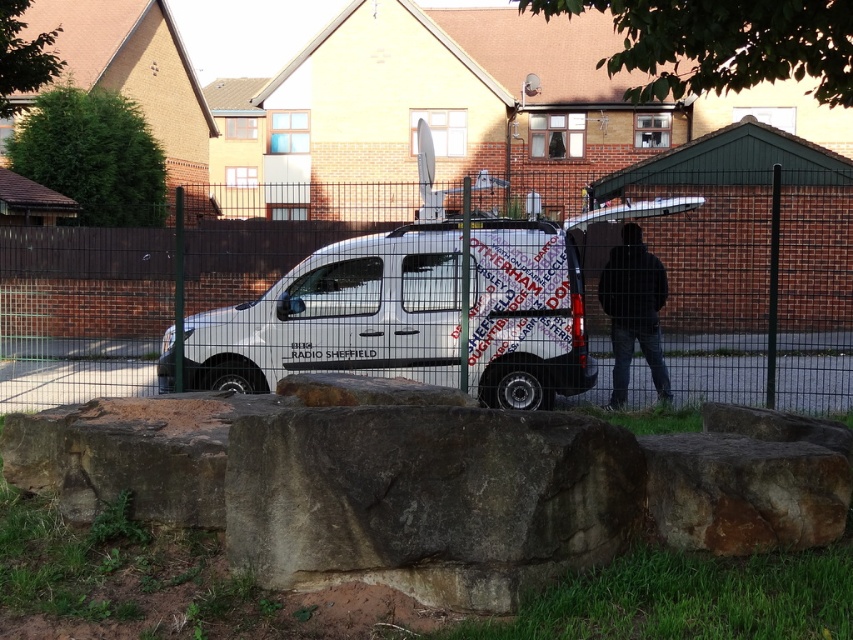
Is brown rough stone at center wider than white metallic van at center?

No.

From the picture: How distant is brown rough stone at center from white metallic van at center?

brown rough stone at center is 4.81 meters from white metallic van at center.

Who is more distant from viewer, (x=596, y=458) or (x=358, y=324)?

Point (x=358, y=324)

The height and width of the screenshot is (640, 853). Identify the location of brown rough stone at center. (428, 499).

Can you confirm if metal wire mesh fence at center is bigger than white metallic van at center?

Correct, metal wire mesh fence at center is larger in size than white metallic van at center.

Is point (260, 378) positioned in front of point (231, 385)?

That is False.

Find the location of a particular element. metal wire mesh fence at center is located at coordinates (222, 307).

Can you confirm if metal wire mesh fence at center is taller than brown rough stone at lower right?

Yes.

From the picture: Does metal wire mesh fence at center have a lesser height compared to brown rough stone at lower right?

No, metal wire mesh fence at center is not shorter than brown rough stone at lower right.

The image size is (853, 640). I want to click on metal wire mesh fence at center, so click(x=222, y=307).

Identify the location of metal wire mesh fence at center. The image size is (853, 640). (222, 307).